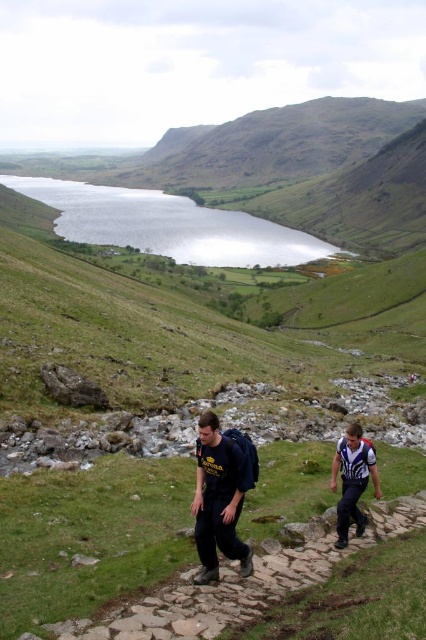
Is dark blue jeans at center to the left of white fabric shirt at lower right from the viewer's perspective?

Correct, you'll find dark blue jeans at center to the left of white fabric shirt at lower right.

Which is more to the left, dark blue jeans at center or white fabric shirt at lower right?

dark blue jeans at center is more to the left.

Between point (229, 548) and point (354, 465), which one is positioned in front?

Point (229, 548) is more forward.

Find the location of a particular element. dark blue jeans at center is located at coordinates (221, 493).

Which is above, dark blue jeans at center or dark blue backpack at center?

Positioned higher is dark blue backpack at center.

Between point (230, 499) and point (218, 540), which one is positioned behind?

Point (230, 499)

Find the location of `dark blue jeans at center`. dark blue jeans at center is located at coordinates (221, 493).

The image size is (426, 640). Identify the location of dark blue jeans at center. pos(221,493).

Between point (26, 252) and point (379, 486), which one is positioned behind?

The point (26, 252) is more distant.

Between point (187, 500) and point (370, 458), which one is positioned in front?

Point (370, 458) is more forward.

At what (x,y) coordinates should I click in order to perform the action: click on green grassy at center. Please return your answer as a coordinate pair (x, y). The image size is (426, 640). Looking at the image, I should click on (152, 337).